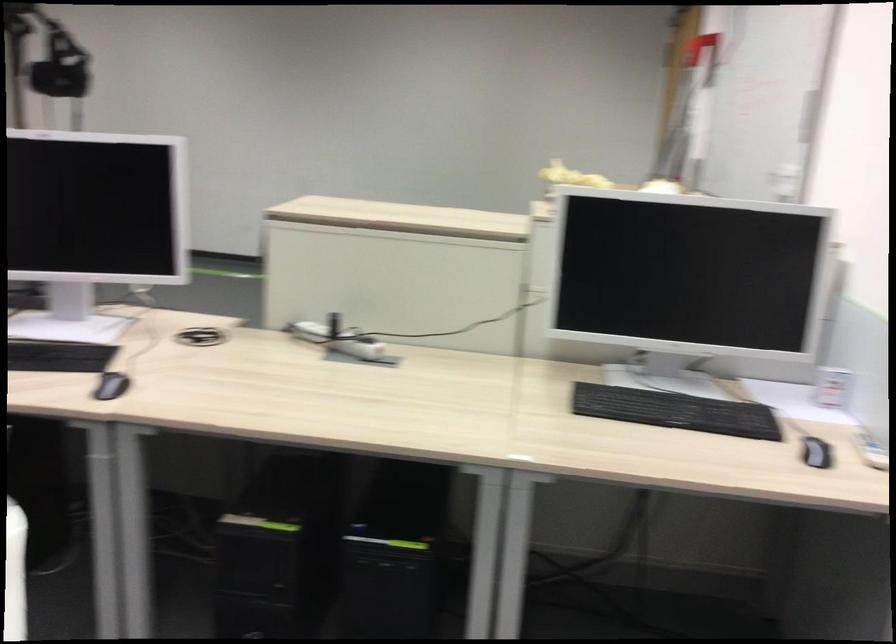
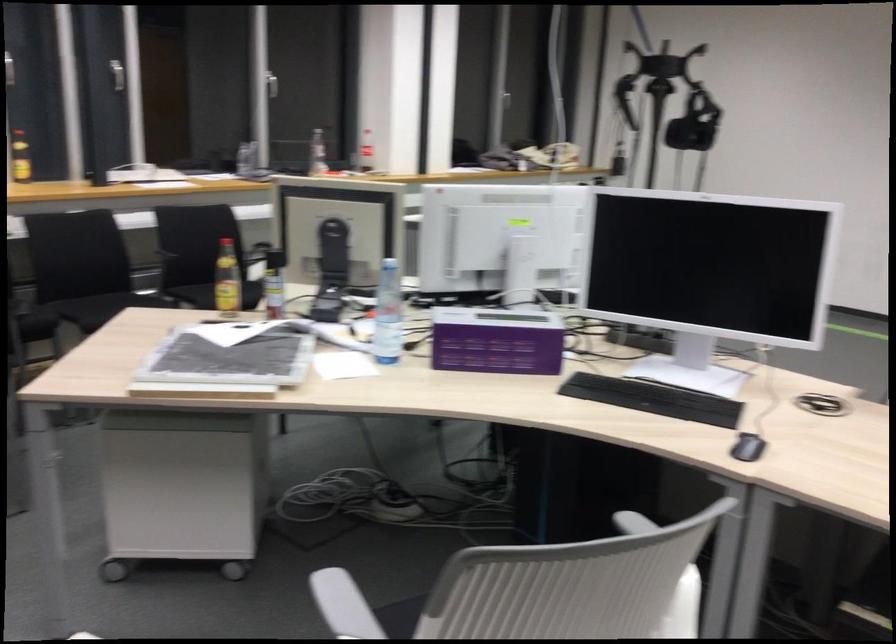
Question: How did the camera likely rotate?

Choices:
 (A) Left
 (B) Right
 (C) Up
 (D) Down

Answer: (A)